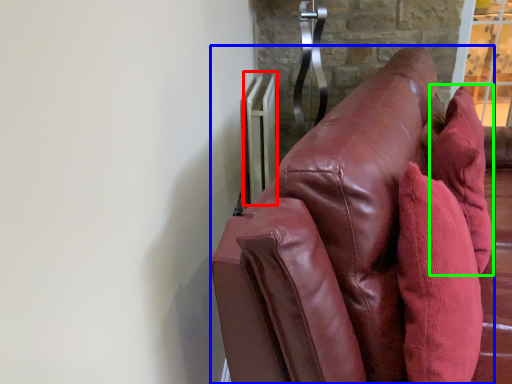
Question: Which object is positioned farthest from radiator (highlighted by a red box)? Select from furniture (highlighted by a blue box) and throw pillow (highlighted by a green box).

Choices:
 (A) furniture
 (B) throw pillow

Answer: (A)